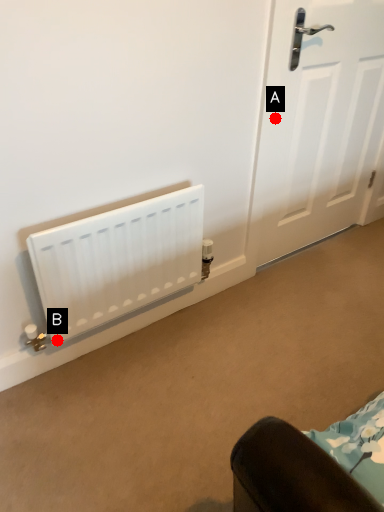
Question: Two points are circled on the image, labeled by A and B beside each circle. Among these points, which one is farthest from the camera?

Choices:
 (A) A is further
 (B) B is further

Answer: (A)